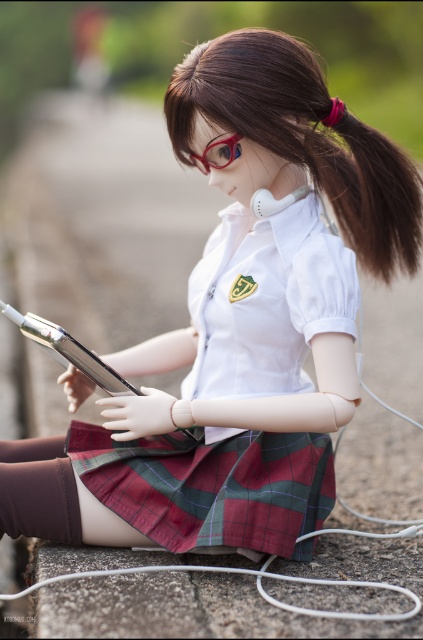
You are a photographer standing at the camera position. You want to take a closeup shot of the doll. The camera can focus on objects within 5 feet. Is the brown silky hair at upper right too far away to be in focus?

The brown silky hair at upper right is 5.45 feet away from the camera, which is beyond the 5 feet focus range. Therefore, it will be out of focus.